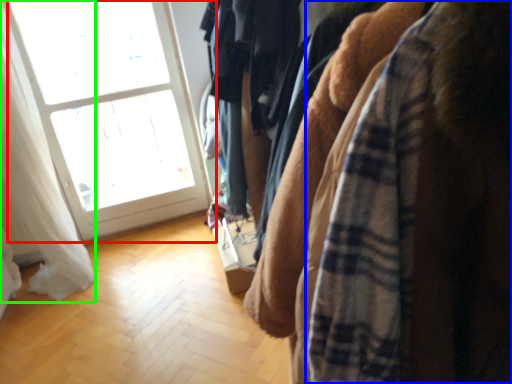
Question: Which object is the closest to the window (highlighted by a red box)? Choose among these: flannel (highlighted by a blue box) or curtain (highlighted by a green box).

Choices:
 (A) flannel
 (B) curtain

Answer: (B)